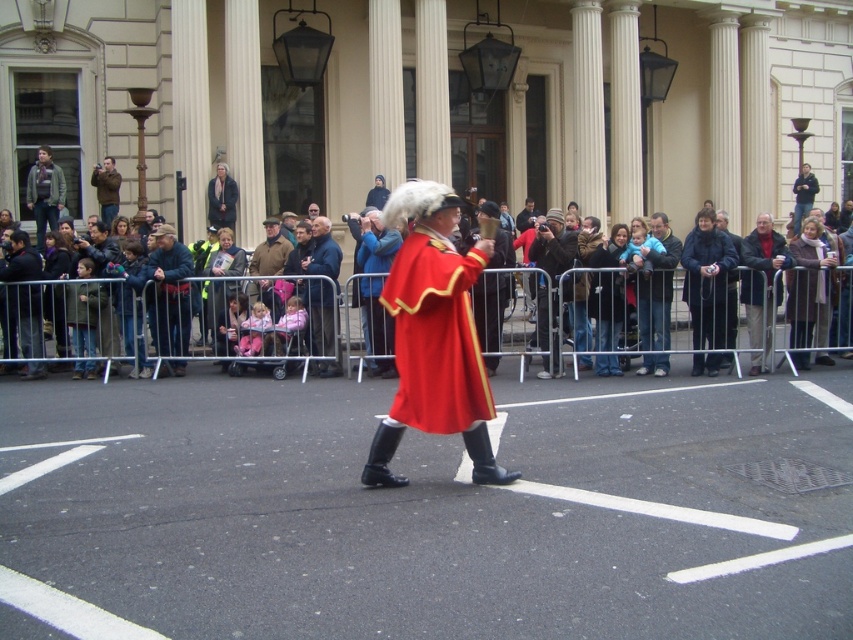
Between gray wool jacket at upper left and brown leather jacket at center, which one has less height?

Standing shorter between the two is brown leather jacket at center.

Is gray wool jacket at upper left smaller than brown leather jacket at center?

No.

Which is in front, point (53, 173) or point (259, 269)?

Point (259, 269) is more forward.

The width and height of the screenshot is (853, 640). What are the coordinates of `gray wool jacket at upper left` in the screenshot? It's located at (44, 193).

Does point (405, 404) come closer to viewer compared to point (323, 292)?

That is True.

Is matte red coat at center shorter than smooth brown coat at center?

Correct, matte red coat at center is not as tall as smooth brown coat at center.

Between point (450, 317) and point (323, 332), which one is positioned in front?

Point (450, 317)

This screenshot has width=853, height=640. Find the location of `matte red coat at center`. matte red coat at center is located at coordinates (434, 337).

Is matte red coat at center thinner than red velvet coat at center?

In fact, matte red coat at center might be wider than red velvet coat at center.

Does matte red coat at center have a lesser height compared to red velvet coat at center?

Yes, matte red coat at center is shorter than red velvet coat at center.

Does point (380, 442) lie behind point (376, 371)?

No.

Locate an element on the screen. The image size is (853, 640). matte red coat at center is located at coordinates (434, 337).